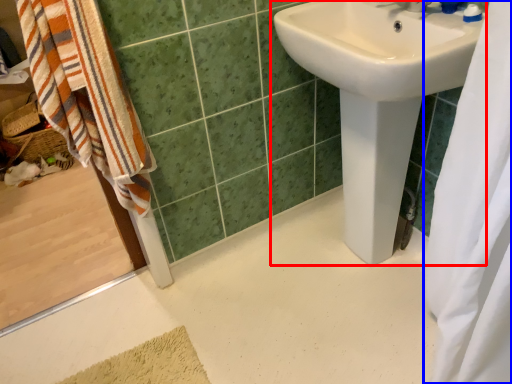
Question: Among these objects, which one is farthest to the camera, sink (highlighted by a red box) or shower curtain (highlighted by a blue box)?

Choices:
 (A) sink
 (B) shower curtain

Answer: (A)